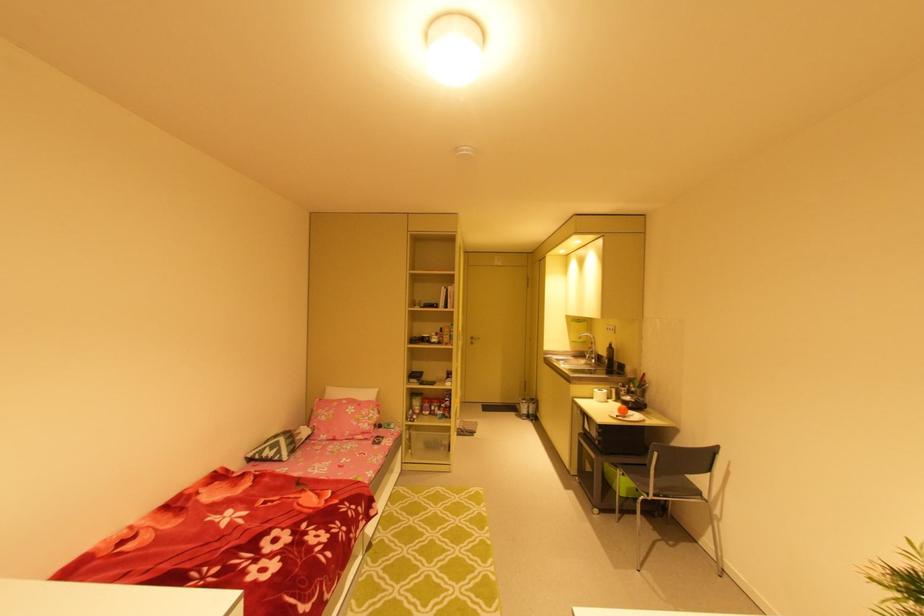
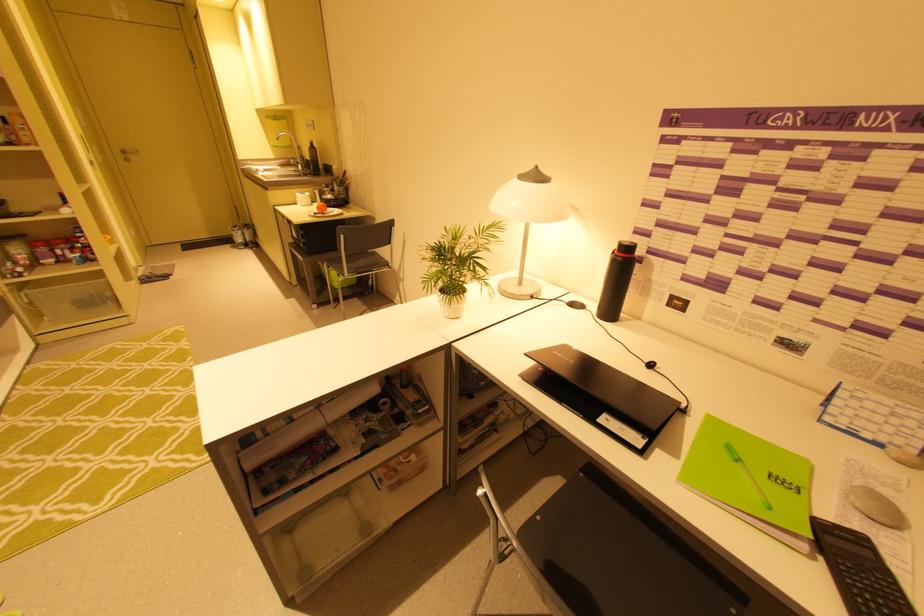
The first image is from the beginning of the video and the second image is from the end. How did the camera likely rotate when shooting the video?

The camera rotated toward right-down.